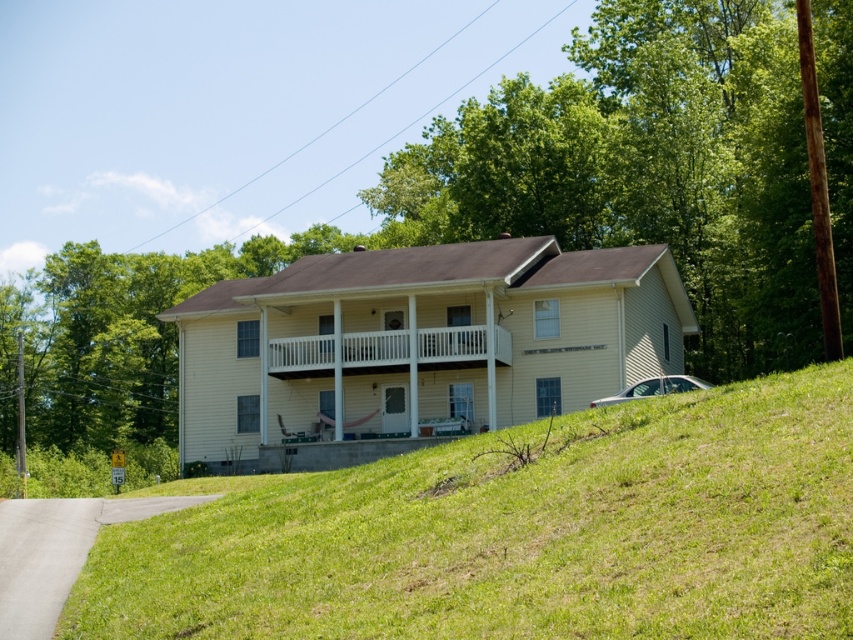
Question: Is green grassy hillside at lower center further to camera compared to white wooden porch at center?

Choices:
 (A) yes
 (B) no

Answer: (B)

Question: Does green grassy hillside at lower center appear under white wooden porch at center?

Choices:
 (A) yes
 (B) no

Answer: (A)

Question: Which object is closer to the camera taking this photo?

Choices:
 (A) white wooden porch at center
 (B) green grassy hillside at lower center

Answer: (B)

Question: Among these points, which one is nearest to the camera?

Choices:
 (A) (762, 481)
 (B) (370, 369)

Answer: (A)

Question: Which point appears farthest from the camera in this image?

Choices:
 (A) (289, 372)
 (B) (73, 632)

Answer: (A)

Question: Is green grassy hillside at lower center further to camera compared to white wooden porch at center?

Choices:
 (A) yes
 (B) no

Answer: (B)